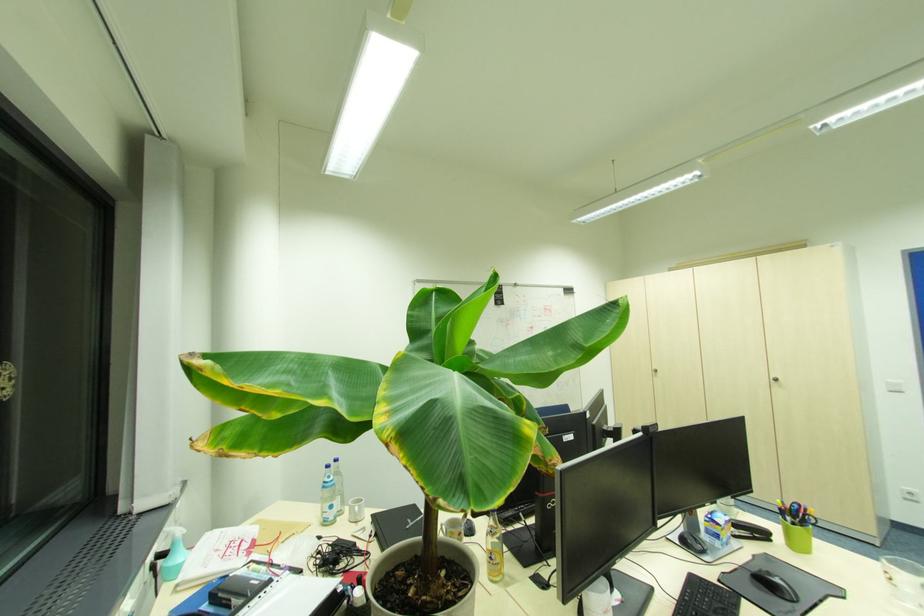
Find where to lift the white mug. Please return your answer as a coordinate pair (x, y).

(356, 509)